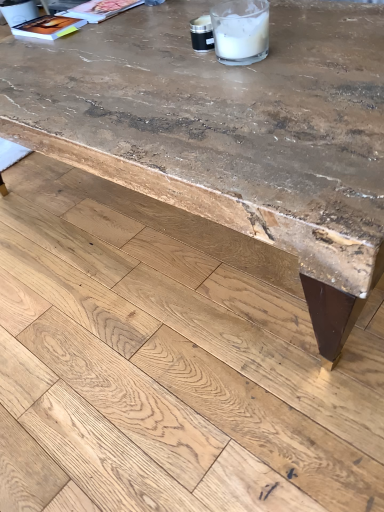
Where is `vacant space in front of matte paper magazine at upper left, which is counted as the 1th magazine, starting from the left`? vacant space in front of matte paper magazine at upper left, which is counted as the 1th magazine, starting from the left is located at coordinates click(35, 52).